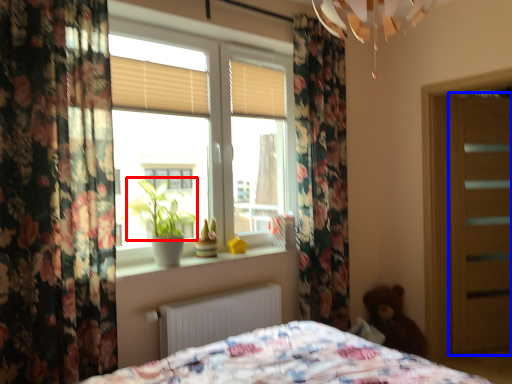
Question: Which point is closer to the camera, plant (highlighted by a red box) or screen door (highlighted by a blue box)?

Choices:
 (A) plant
 (B) screen door

Answer: (A)